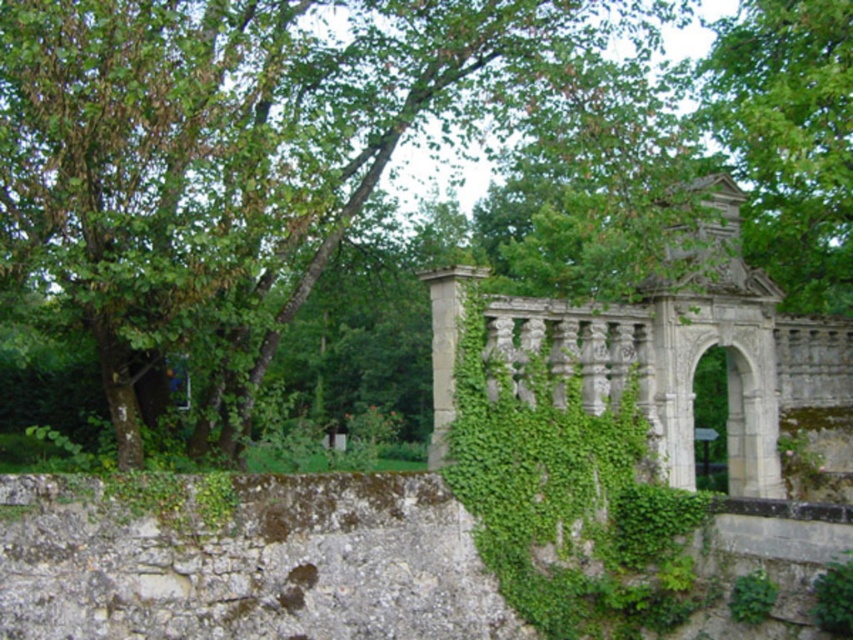
Find the location of `green leafy tree at upper left`. green leafy tree at upper left is located at coordinates (253, 144).

Is green leafy tree at upper left to the right of green leafy tree at upper center from the viewer's perspective?

In fact, green leafy tree at upper left is to the left of green leafy tree at upper center.

Who is more distant from viewer, (643, 168) or (791, 51)?

Point (791, 51)

At what (x,y) coordinates should I click in order to perform the action: click on green leafy tree at upper left. Please return your answer as a coordinate pair (x, y). Image resolution: width=853 pixels, height=640 pixels. Looking at the image, I should click on (253, 144).